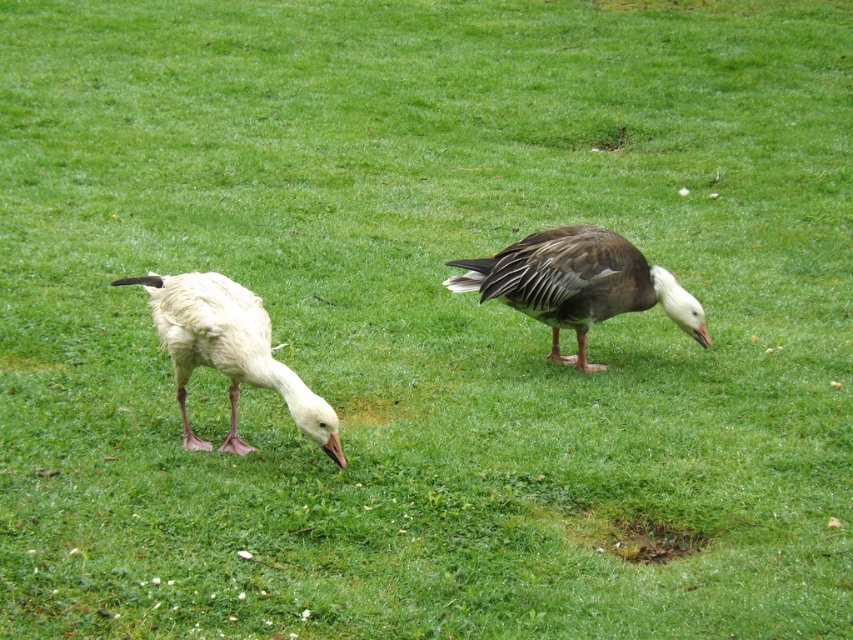
Is point (527, 244) behind point (236, 394)?

Yes, point (527, 244) is farther from viewer.

Who is positioned more to the left, brown feathered duck at center or white matte goose at left?

white matte goose at left

Is point (527, 296) more distant than point (260, 348)?

Yes, point (527, 296) is behind point (260, 348).

You are a GUI agent. You are given a task and a screenshot of the screen. Output one action in this format:
    pyautogui.click(x=<x>, y=<y>)
    Task: Click on the brown feathered duck at center
    This screenshot has width=853, height=640.
    Given the screenshot: What is the action you would take?
    pyautogui.click(x=577, y=284)